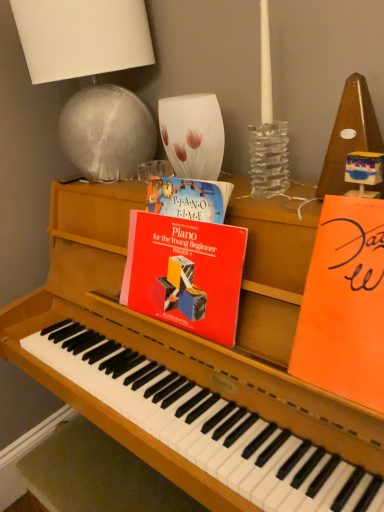
This screenshot has width=384, height=512. What are the coordinates of `white fabric lampshade at upper left` in the screenshot? It's located at (82, 37).

From the picture: From the image's perspective, is orange matte paper at right, placed as the second paperback book when sorted from left to right, located above red matte piano book at center, which is the second paperback book in right-to-left order?

Incorrect, from the image's perspective, orange matte paper at right, placed as the second paperback book when sorted from left to right, is lower than red matte piano book at center, which is the second paperback book in right-to-left order.

From a real-world perspective, between orange matte paper at right, placed as the second paperback book when sorted from left to right, and red matte piano book at center, which is the second paperback book in right-to-left order, who is vertically lower?

red matte piano book at center, which is the second paperback book in right-to-left order, from a real-world perspective.

Considering the sizes of objects orange matte paper at right, which is counted as the 1th paperback book, starting from the right, and red matte piano book at center, marked as the first paperback book in a left-to-right arrangement, in the image provided, who is wider, orange matte paper at right, which is counted as the 1th paperback book, starting from the right, or red matte piano book at center, marked as the first paperback book in a left-to-right arrangement,?

Wider between the two is orange matte paper at right, which is counted as the 1th paperback book, starting from the right.

Is orange matte paper at right, placed as the second paperback book when sorted from left to right, far from red matte piano book at center, which is the second paperback book in right-to-left order?

No, there isn't a large distance between orange matte paper at right, placed as the second paperback book when sorted from left to right, and red matte piano book at center, which is the second paperback book in right-to-left order.

Is white fabric lampshade at upper left in contact with orange matte paper at right, placed as the second paperback book when sorted from left to right?

white fabric lampshade at upper left is not next to orange matte paper at right, placed as the second paperback book when sorted from left to right, and they're not touching.

What's the angular difference between white fabric lampshade at upper left and orange matte paper at right, placed as the second paperback book when sorted from left to right,'s facing directions?

The angle between the facing direction of white fabric lampshade at upper left and the facing direction of orange matte paper at right, placed as the second paperback book when sorted from left to right, is 33.1 degrees.

From a real-world perspective, count 1st paperback books downward from the white fabric lampshade at upper left and point to it. Please provide its 2D coordinates.

[(344, 304)]

Looking at this image, is white fabric lampshade at upper left closer to the viewer compared to orange matte paper at right, placed as the second paperback book when sorted from left to right?

No, the depth of white fabric lampshade at upper left is greater than that of orange matte paper at right, placed as the second paperback book when sorted from left to right.

Between point (372, 342) and point (115, 163), which one is positioned behind?

Point (115, 163)

Is orange matte paper at right, placed as the second paperback book when sorted from left to right, not near white fabric lampshade at upper left?

That's not correct — orange matte paper at right, placed as the second paperback book when sorted from left to right, is a little close to white fabric lampshade at upper left.

From a real-world perspective, which is physically below, orange matte paper at right, which is counted as the 1th paperback book, starting from the right, or white fabric lampshade at upper left?

In real-world perspective, orange matte paper at right, which is counted as the 1th paperback book, starting from the right, is lower.

From the image's perspective, is orange matte paper at right, placed as the second paperback book when sorted from left to right, below white fabric lampshade at upper left?

Yes.

This screenshot has width=384, height=512. Identify the location of paperback book lying in front of the red matte piano book at center, marked as the first paperback book in a left-to-right arrangement. (344, 304).

Considering their positions, is red matte piano book at center, which is the second paperback book in right-to-left order, located in front of or behind orange matte paper at right, placed as the second paperback book when sorted from left to right?

Clearly, red matte piano book at center, which is the second paperback book in right-to-left order, is behind orange matte paper at right, placed as the second paperback book when sorted from left to right.

Looking at this image, which is correct: red matte piano book at center, which is the second paperback book in right-to-left order, is inside orange matte paper at right, which is counted as the 1th paperback book, starting from the right, or outside of it?

red matte piano book at center, which is the second paperback book in right-to-left order, lies outside orange matte paper at right, which is counted as the 1th paperback book, starting from the right.

Is red matte piano book at center, which is the second paperback book in right-to-left order, positioned beyond the bounds of white fabric lampshade at upper left?

Indeed, red matte piano book at center, which is the second paperback book in right-to-left order, is completely outside white fabric lampshade at upper left.

Which object is positioned more to the right, red matte piano book at center, which is the second paperback book in right-to-left order, or white fabric lampshade at upper left?

red matte piano book at center, which is the second paperback book in right-to-left order, is more to the right.

Is red matte piano book at center, marked as the first paperback book in a left-to-right arrangement, turned away from white fabric lampshade at upper left?

No.

From the image's perspective, would you say red matte piano book at center, which is the second paperback book in right-to-left order, is positioned over white fabric lampshade at upper left?

No.

Would you say white fabric lampshade at upper left is outside red matte piano book at center, which is the second paperback book in right-to-left order?

white fabric lampshade at upper left is positioned outside red matte piano book at center, which is the second paperback book in right-to-left order.

From a real-world perspective, is white fabric lampshade at upper left positioned under red matte piano book at center, which is the second paperback book in right-to-left order, based on gravity?

Actually, white fabric lampshade at upper left is physically above red matte piano book at center, which is the second paperback book in right-to-left order, in the real world.

Considering the positions of objects white fabric lampshade at upper left and red matte piano book at center, marked as the first paperback book in a left-to-right arrangement, in the image provided, who is behind, white fabric lampshade at upper left or red matte piano book at center, marked as the first paperback book in a left-to-right arrangement,?

white fabric lampshade at upper left is further away from the camera.

Where is `paperback book on the right of red matte piano book at center, marked as the first paperback book in a left-to-right arrangement`? This screenshot has width=384, height=512. paperback book on the right of red matte piano book at center, marked as the first paperback book in a left-to-right arrangement is located at coordinates (344, 304).

From the image's perspective, starting from the white fabric lampshade at upper left, which paperback book is the 2nd one below? Please provide its 2D coordinates.

[(344, 304)]

From the image, which object appears to be nearer to orange matte paper at right, placed as the second paperback book when sorted from left to right, white fabric lampshade at upper left or red matte piano book at center, which is the second paperback book in right-to-left order?

red matte piano book at center, which is the second paperback book in right-to-left order, is positioned closer to the anchor orange matte paper at right, placed as the second paperback book when sorted from left to right.

From the image, which object appears to be nearer to orange matte paper at right, which is counted as the 1th paperback book, starting from the right, red matte piano book at center, marked as the first paperback book in a left-to-right arrangement, or white fabric lampshade at upper left?

Based on the image, red matte piano book at center, marked as the first paperback book in a left-to-right arrangement, appears to be nearer to orange matte paper at right, which is counted as the 1th paperback book, starting from the right.

Based on their spatial positions, is red matte piano book at center, marked as the first paperback book in a left-to-right arrangement, or orange matte paper at right, placed as the second paperback book when sorted from left to right, further from white fabric lampshade at upper left?

orange matte paper at right, placed as the second paperback book when sorted from left to right, lies further to white fabric lampshade at upper left than the other object.

Based on their spatial positions, is orange matte paper at right, placed as the second paperback book when sorted from left to right, or red matte piano book at center, which is the second paperback book in right-to-left order, further from white fabric lampshade at upper left?

orange matte paper at right, placed as the second paperback book when sorted from left to right, is further to white fabric lampshade at upper left.

Consider the image. Which object lies nearer to the anchor point red matte piano book at center, marked as the first paperback book in a left-to-right arrangement, white fabric lampshade at upper left or orange matte paper at right, which is counted as the 1th paperback book, starting from the right?

orange matte paper at right, which is counted as the 1th paperback book, starting from the right, is closer to red matte piano book at center, marked as the first paperback book in a left-to-right arrangement.

Consider the image. Which object lies further to the anchor point red matte piano book at center, which is the second paperback book in right-to-left order, orange matte paper at right, which is counted as the 1th paperback book, starting from the right, or white fabric lampshade at upper left?

Based on the image, white fabric lampshade at upper left appears to be further to red matte piano book at center, which is the second paperback book in right-to-left order.

At what (x,y) coordinates should I click in order to perform the action: click on paperback book between white fabric lampshade at upper left and orange matte paper at right, which is counted as the 1th paperback book, starting from the right, in the up-down direction. Please return your answer as a coordinate pair (x, y). The image size is (384, 512). Looking at the image, I should click on [185, 273].